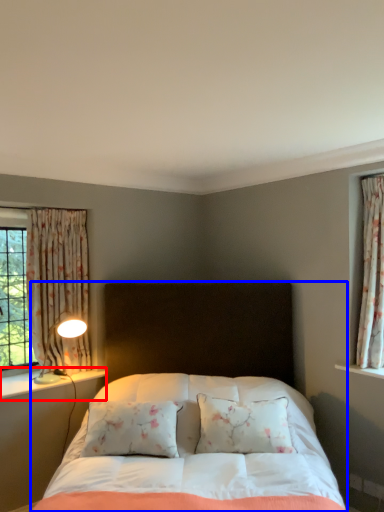
Question: Which point is further to the camera, window sill (highlighted by a red box) or bed (highlighted by a blue box)?

Choices:
 (A) window sill
 (B) bed

Answer: (A)